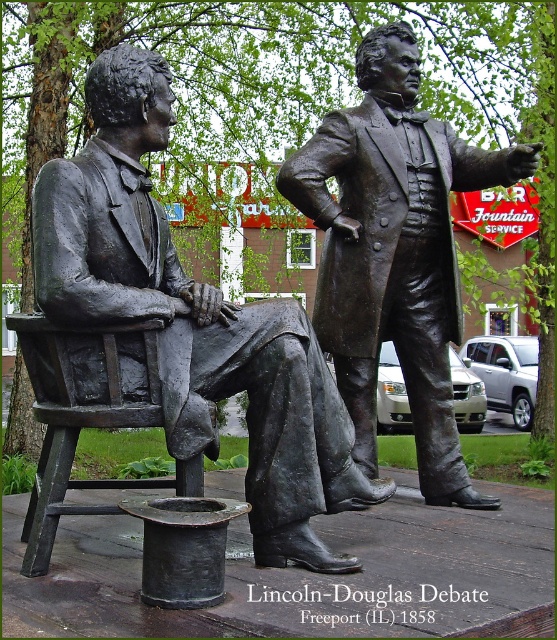
Question: Can you confirm if bronze statue at center is bigger than bronze wooden chair at left?

Choices:
 (A) no
 (B) yes

Answer: (B)

Question: Is bronze statue at center further to the viewer compared to bronze wooden chair at left?

Choices:
 (A) no
 (B) yes

Answer: (B)

Question: Does bronze statue of man sitting at left have a greater width compared to bronze statue at center?

Choices:
 (A) no
 (B) yes

Answer: (B)

Question: Which point is farther from the camera taking this photo?

Choices:
 (A) (106, 56)
 (B) (367, 410)

Answer: (B)

Question: Estimate the real-world distances between objects in this image. Which object is closer to the bronze statue at center?

Choices:
 (A) bronze statue of man sitting at left
 (B) bronze wooden chair at left

Answer: (A)

Question: Which point is farther from the camera taking this photo?

Choices:
 (A) (305, 154)
 (B) (51, 388)

Answer: (A)